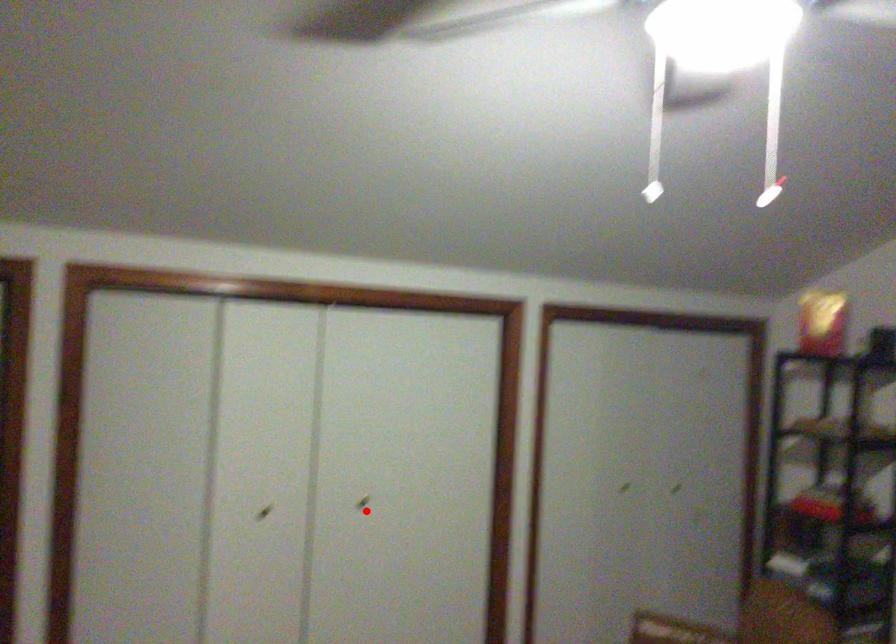
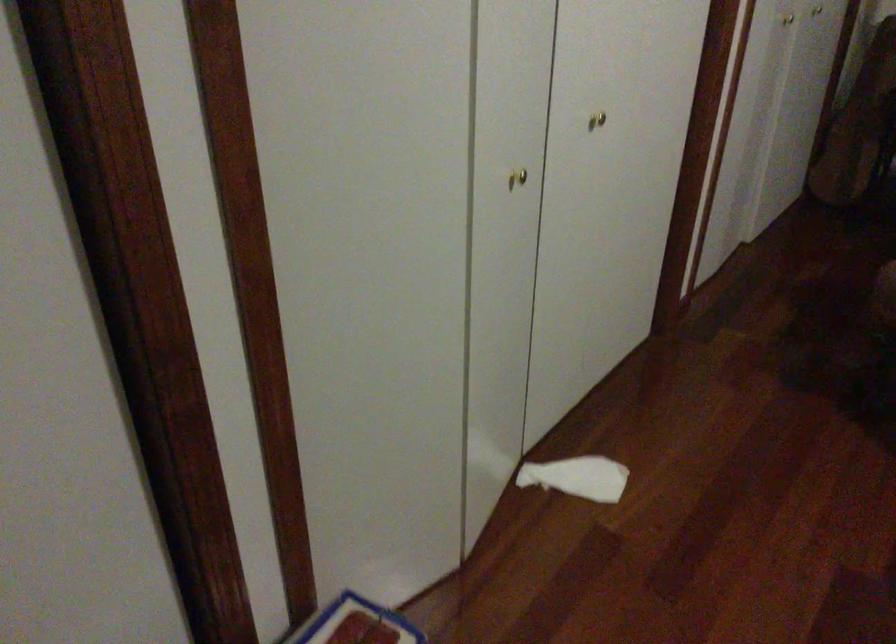
Question: I am providing you with two images of the same scene from different viewpoints. In image1, a red point is highlighted. Considering the same 3D point in image2, which of the following is correct?

Choices:
 (A) It is closer
 (B) It is farther

Answer: (A)